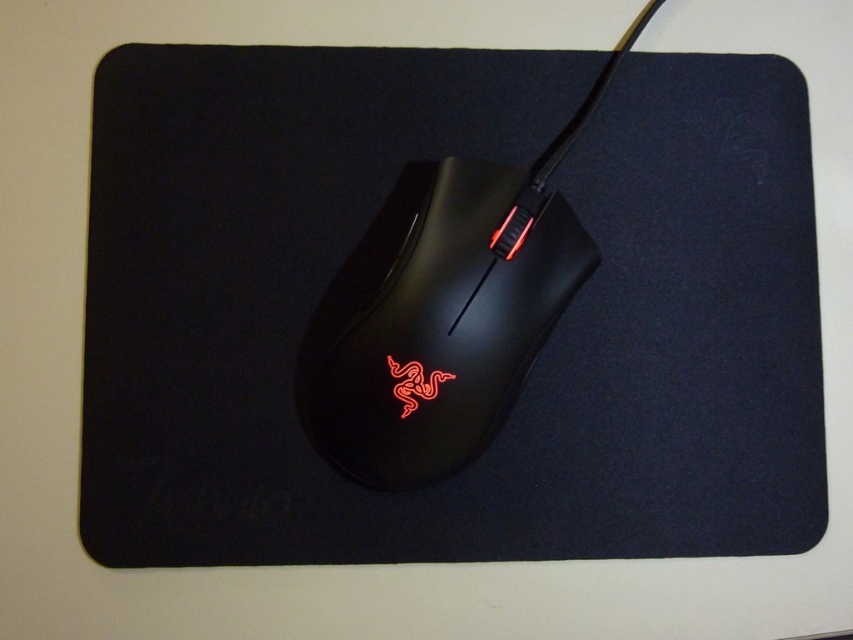
Question: Where is black matte mousepad at center located in relation to matte black mouse at center in the image?

Choices:
 (A) left
 (B) right

Answer: (B)

Question: Which of the following is the farthest from the observer?

Choices:
 (A) (178, 250)
 (B) (421, 406)

Answer: (A)

Question: Is black matte mousepad at center to the right of matte black mouse at center from the viewer's perspective?

Choices:
 (A) no
 (B) yes

Answer: (B)

Question: Does black matte mousepad at center come in front of matte black mouse at center?

Choices:
 (A) yes
 (B) no

Answer: (A)